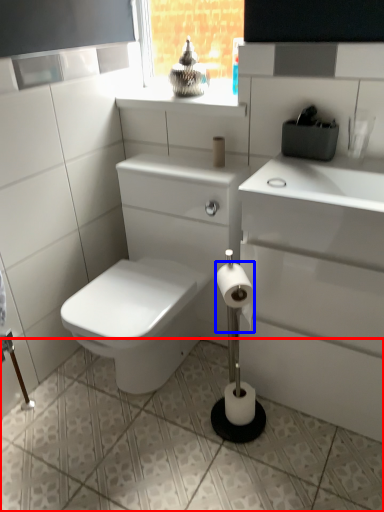
Question: Which point is further to the camera, ceramic tile (highlighted by a red box) or toilet paper (highlighted by a blue box)?

Choices:
 (A) ceramic tile
 (B) toilet paper

Answer: (B)